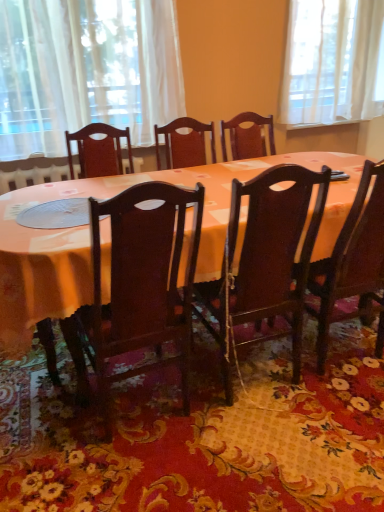
Image resolution: width=384 pixels, height=512 pixels. In order to click on free location in front of dark wood chair at right, which appears as the 3th chair when viewed from the left in this screenshot , I will do `click(335, 417)`.